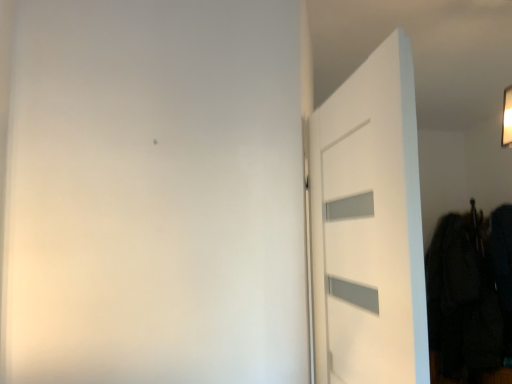
Question: Is white matte door at right thinner than dark fabric coat at right?

Choices:
 (A) yes
 (B) no

Answer: (A)

Question: Is white matte door at right wider than dark fabric coat at right?

Choices:
 (A) yes
 (B) no

Answer: (B)

Question: Could dark fabric coat at right be considered to be inside white matte door at right?

Choices:
 (A) no
 (B) yes

Answer: (A)

Question: Is white matte door at right at the right side of dark fabric coat at right?

Choices:
 (A) yes
 (B) no

Answer: (B)

Question: Considering the relative sizes of white matte door at right and dark fabric coat at right in the image provided, is white matte door at right smaller than dark fabric coat at right?

Choices:
 (A) yes
 (B) no

Answer: (A)

Question: Is white matte door at right positioned far away from dark fabric coat at right?

Choices:
 (A) no
 (B) yes

Answer: (B)

Question: From the image's perspective, is dark fabric coat at right beneath white matte door at right?

Choices:
 (A) no
 (B) yes

Answer: (B)

Question: Can you confirm if dark fabric coat at right is bigger than white matte door at right?

Choices:
 (A) yes
 (B) no

Answer: (A)

Question: From a real-world perspective, is dark fabric coat at right below white matte door at right?

Choices:
 (A) yes
 (B) no

Answer: (A)

Question: Is dark fabric coat at right shorter than white matte door at right?

Choices:
 (A) no
 (B) yes

Answer: (A)

Question: Are dark fabric coat at right and white matte door at right far apart?

Choices:
 (A) yes
 (B) no

Answer: (A)

Question: Considering the relative sizes of dark fabric coat at right and white matte door at right in the image provided, is dark fabric coat at right taller than white matte door at right?

Choices:
 (A) yes
 (B) no

Answer: (A)

Question: In terms of width, does dark fabric coat at right look wider or thinner when compared to white matte door at right?

Choices:
 (A) thin
 (B) wide

Answer: (B)